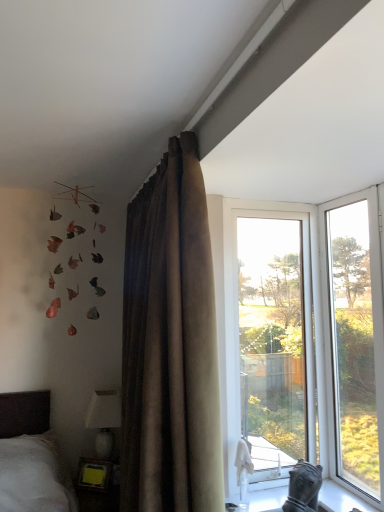
Question: From a real-world perspective, is transparent glass window at right, arranged as the first window when viewed from the right, beneath brown velvet curtain at upper center?

Choices:
 (A) no
 (B) yes

Answer: (A)

Question: Is transparent glass window at right, the 2th window in the left-to-right sequence, positioned behind brown velvet curtain at upper center?

Choices:
 (A) yes
 (B) no

Answer: (A)

Question: Can you confirm if transparent glass window at right, arranged as the first window when viewed from the right, is shorter than brown velvet curtain at upper center?

Choices:
 (A) yes
 (B) no

Answer: (A)

Question: Is transparent glass window at right, the 2th window in the left-to-right sequence, at the right side of brown velvet curtain at upper center?

Choices:
 (A) no
 (B) yes

Answer: (B)

Question: From a real-world perspective, does transparent glass window at right, arranged as the first window when viewed from the right, stand above brown velvet curtain at upper center?

Choices:
 (A) yes
 (B) no

Answer: (A)

Question: From the image's perspective, would you say transparent glass window at right, arranged as the first window when viewed from the right, is shown under brown velvet curtain at upper center?

Choices:
 (A) yes
 (B) no

Answer: (B)

Question: From a real-world perspective, is transparent glass window at center, which ranks as the first window in left-to-right order, located higher than white glossy stone at lower right?

Choices:
 (A) yes
 (B) no

Answer: (A)

Question: Does transparent glass window at center, which ranks as the first window in left-to-right order, have a lesser width compared to white glossy stone at lower right?

Choices:
 (A) yes
 (B) no

Answer: (A)

Question: Is transparent glass window at center, which is counted as the second window, starting from the right, taller than white glossy stone at lower right?

Choices:
 (A) no
 (B) yes

Answer: (B)

Question: Considering the relative sizes of transparent glass window at center, which is counted as the second window, starting from the right, and white glossy stone at lower right in the image provided, is transparent glass window at center, which is counted as the second window, starting from the right, smaller than white glossy stone at lower right?

Choices:
 (A) yes
 (B) no

Answer: (B)

Question: Considering the relative sizes of transparent glass window at center, which is counted as the second window, starting from the right, and white glossy stone at lower right in the image provided, is transparent glass window at center, which is counted as the second window, starting from the right, wider than white glossy stone at lower right?

Choices:
 (A) no
 (B) yes

Answer: (A)

Question: Is transparent glass window at center, which ranks as the first window in left-to-right order, with white glossy stone at lower right?

Choices:
 (A) yes
 (B) no

Answer: (B)

Question: Would you say transparent glass window at center, which is counted as the second window, starting from the right, contains white glossy lampshade at lower left?

Choices:
 (A) yes
 (B) no

Answer: (B)